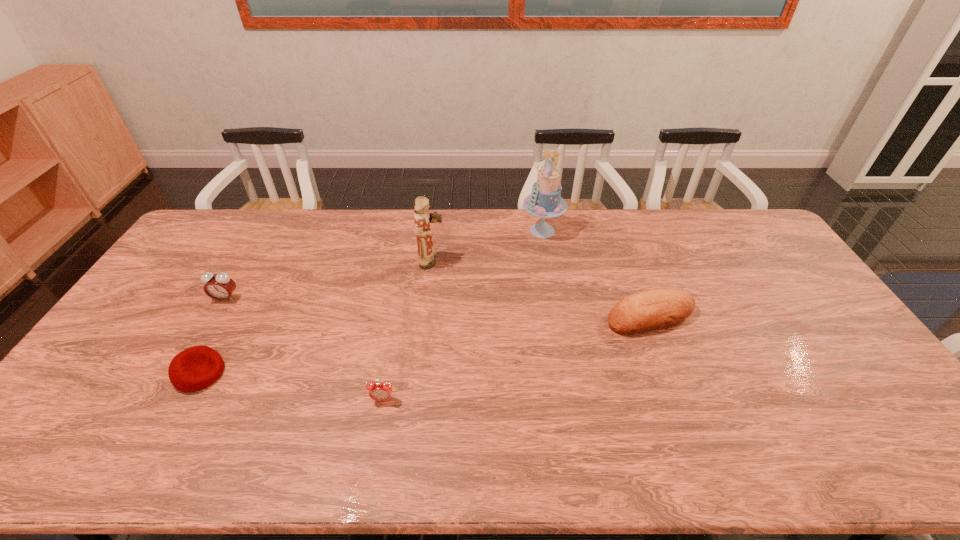
Locate an element on the screen. The width and height of the screenshot is (960, 540). free region located 0.370m with a ladder on the side of the cake is located at coordinates (421, 231).

Image resolution: width=960 pixels, height=540 pixels. What are the coordinates of `vacant space located with a ladder on the side of the cake` in the screenshot? It's located at (438, 231).

This screenshot has height=540, width=960. In order to click on free space located 0.340m with a ladder on the side of the cake in this screenshot , I will do `click(429, 231)`.

Where is `vacant space located on the front-facing side of the second tallest object`? This screenshot has height=540, width=960. vacant space located on the front-facing side of the second tallest object is located at coordinates (477, 262).

Identify the location of vacant area situated 0.310m on the clock face of the taller alarm clock. The width and height of the screenshot is (960, 540). (172, 391).

Find the location of a particular element. The image size is (960, 540). vacant region located 0.080m on the face of the nearer alarm clock is located at coordinates (376, 434).

You are a GUI agent. You are given a task and a screenshot of the screen. Output one action in this format:
    pyautogui.click(x=<x>, y=<y>)
    Task: Click on the free space located on the back of the bread
    The width and height of the screenshot is (960, 540).
    Given the screenshot: What is the action you would take?
    pyautogui.click(x=622, y=241)

Locate an element on the screen. vacant region located 0.310m on the seat area of the fifth farthest object is located at coordinates (340, 374).

Identify the location of object located in the far edge section of the desktop. (545, 201).

Find the location of a particular element. This screenshot has height=540, width=960. vacant area at the far edge is located at coordinates (244, 237).